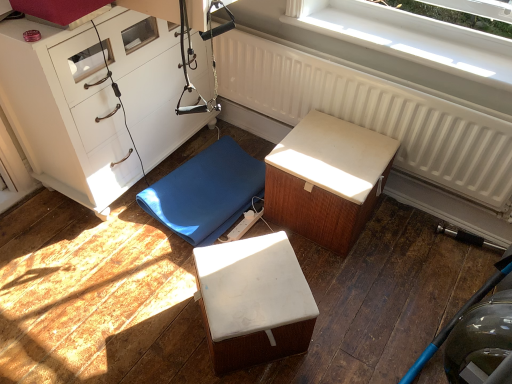
Locate an element on the screen. Image resolution: width=512 pixels, height=384 pixels. free space on the front side of white matte chest of drawers at left is located at coordinates (90, 268).